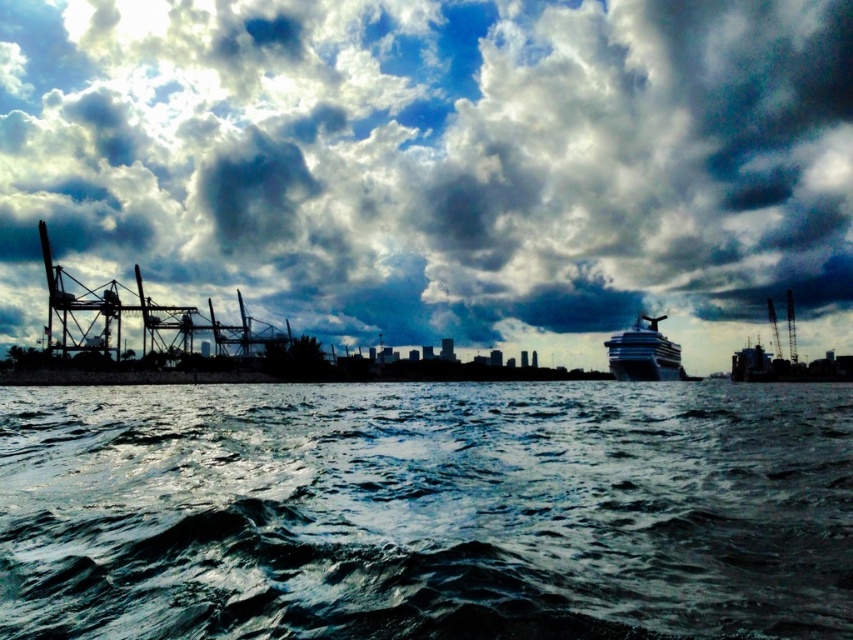
Is cloudy sky at upper center behind white glossy cruise ship at right?

Yes, cloudy sky at upper center is further from the viewer.

Between point (476, 225) and point (625, 364), which one is positioned in front?

Point (625, 364)

The width and height of the screenshot is (853, 640). What are the coordinates of `cloudy sky at upper center` in the screenshot? It's located at [x=438, y=161].

Can you confirm if cloudy sky at upper center is shorter than dark blue water at lower center?

No, cloudy sky at upper center is not shorter than dark blue water at lower center.

Does cloudy sky at upper center appear over dark blue water at lower center?

Yes, cloudy sky at upper center is above dark blue water at lower center.

Who is more distant from viewer, (772,252) or (366,444)?

The point (772,252) is more distant.

Identify the location of cloudy sky at upper center. (438, 161).

Is dark blue water at lower center to the right of white glossy cruise ship at right from the viewer's perspective?

No, dark blue water at lower center is not to the right of white glossy cruise ship at right.

Which is behind, point (392, 589) or point (672, 378)?

Positioned behind is point (672, 378).

Locate an element on the screen. The image size is (853, 640). dark blue water at lower center is located at coordinates click(426, 512).